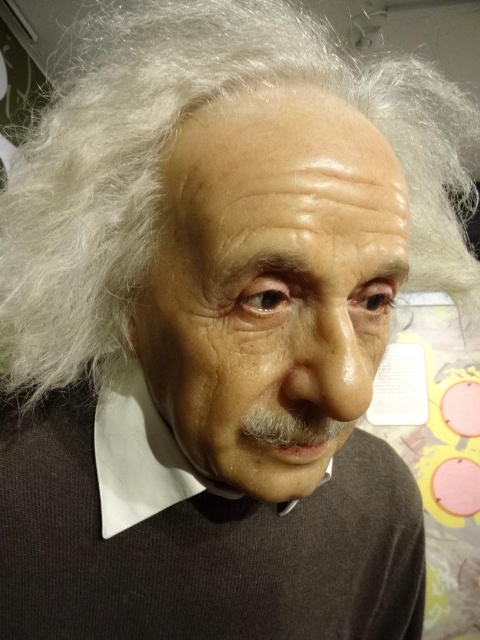
Can you confirm if white matte hair at center is thinner than white matte shirt at center?

No, white matte hair at center is not thinner than white matte shirt at center.

Is white matte hair at center to the left of white matte shirt at center from the viewer's perspective?

No, white matte hair at center is not to the left of white matte shirt at center.

Find the location of `white matte hair at center`. white matte hair at center is located at coordinates (158, 161).

Image resolution: width=480 pixels, height=640 pixels. Find the location of `white matte hair at center`. white matte hair at center is located at coordinates (158, 161).

How distant is matte black sweater at center from white matte shirt at center?

matte black sweater at center and white matte shirt at center are 2.31 inches apart.

Can you confirm if matte black sweater at center is positioned to the right of white matte shirt at center?

Indeed, matte black sweater at center is positioned on the right side of white matte shirt at center.

Does point (391, 513) come behind point (112, 413)?

Yes, point (391, 513) is farther from viewer.

Identify the location of matte black sweater at center. This screenshot has height=640, width=480. (192, 536).

Does matte black sweater at center have a greater width compared to white matte hair at center?

No, matte black sweater at center is not wider than white matte hair at center.

Does matte black sweater at center have a larger size compared to white matte hair at center?

No.

Who is more distant from viewer, (x=408, y=490) or (x=407, y=157)?

The point (x=408, y=490) is behind.

Where is `matte black sweater at center`? matte black sweater at center is located at coordinates (192, 536).